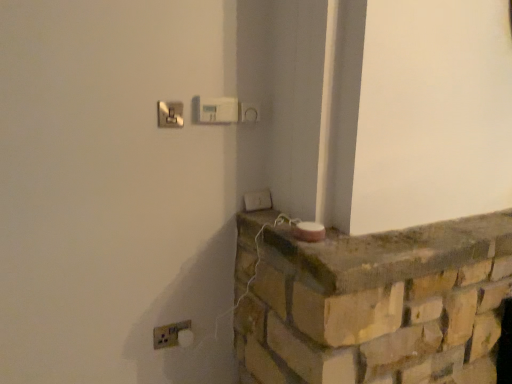
Question: Is matte silver switch at upper center, acting as the 1th light switch starting from the front, shorter than white plastic light switch at upper center, which is the first light switch from top to bottom?

Choices:
 (A) no
 (B) yes

Answer: (B)

Question: Could white plastic light switch at upper center, which is the first light switch from top to bottom, be considered to be inside matte silver switch at upper center, acting as the 1th light switch starting from the front?

Choices:
 (A) no
 (B) yes

Answer: (A)

Question: Is matte silver switch at upper center, the second light switch from the top, touching white plastic light switch at upper center, which is the third light switch in bottom-to-top order?

Choices:
 (A) yes
 (B) no

Answer: (B)

Question: Is matte silver switch at upper center, the second light switch from the top, positioned before white plastic light switch at upper center, the second light switch from the left?

Choices:
 (A) yes
 (B) no

Answer: (A)

Question: Can you confirm if matte silver switch at upper center, the second light switch from the top, is wider than white plastic light switch at upper center, which is the second light switch in right-to-left order?

Choices:
 (A) no
 (B) yes

Answer: (A)

Question: Looking at the image, does white plastic light switch at lower center, positioned as the first light switch in right-to-left order, seem bigger or smaller compared to white plastic light switch at upper center, which is the second light switch in right-to-left order?

Choices:
 (A) big
 (B) small

Answer: (B)

Question: Is white plastic light switch at lower center, acting as the 3th light switch starting from the left, wider or thinner than white plastic light switch at upper center, placed as the second light switch when sorted from front to back?

Choices:
 (A) thin
 (B) wide

Answer: (B)

Question: From a real-world perspective, is white plastic light switch at lower center, marked as the 3th light switch in a top-to-bottom arrangement, physically located above or below white plastic light switch at upper center, which is the second light switch in right-to-left order?

Choices:
 (A) above
 (B) below

Answer: (B)

Question: From the image's perspective, relative to white plastic light switch at upper center, which is the third light switch in bottom-to-top order, is white plastic light switch at lower center, acting as the 1th light switch starting from the back, above or below?

Choices:
 (A) below
 (B) above

Answer: (A)

Question: Considering their positions, is white plastic electric outlet at lower left located in front of or behind white plastic light switch at lower center, the 1th light switch positioned from the bottom?

Choices:
 (A) front
 (B) behind

Answer: (A)

Question: Based on their sizes in the image, would you say white plastic electric outlet at lower left is bigger or smaller than white plastic light switch at lower center, the 1th light switch positioned from the bottom?

Choices:
 (A) big
 (B) small

Answer: (B)

Question: Is point pos(167,332) positioned closer to the camera than point pos(252,196)?

Choices:
 (A) closer
 (B) farther

Answer: (A)

Question: In terms of width, does white plastic electric outlet at lower left look wider or thinner when compared to white plastic light switch at lower center, marked as the 3th light switch in a top-to-bottom arrangement?

Choices:
 (A) thin
 (B) wide

Answer: (A)

Question: Is matte silver switch at upper center, the second light switch from the top, in front of or behind white plastic light switch at lower center, positioned as the first light switch in right-to-left order, in the image?

Choices:
 (A) front
 (B) behind

Answer: (A)

Question: Is matte silver switch at upper center, the 3th light switch viewed from the right, wider or thinner than white plastic light switch at lower center, the 1th light switch positioned from the bottom?

Choices:
 (A) wide
 (B) thin

Answer: (B)